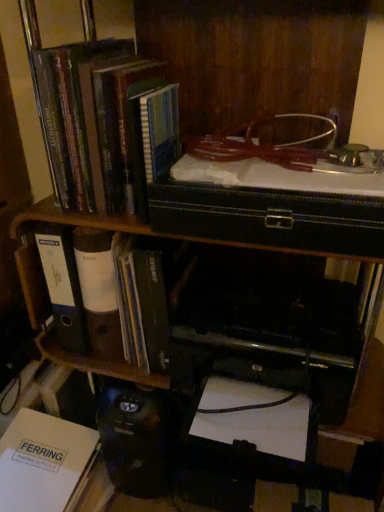
Question: Does black plastic printer at lower center come behind white paper folder at left, the 2th book in the top-to-bottom sequence?

Choices:
 (A) no
 (B) yes

Answer: (A)

Question: Is white paper folder at left, the 2th book in the top-to-bottom sequence, surrounded by black plastic printer at lower center?

Choices:
 (A) no
 (B) yes

Answer: (A)

Question: Is black plastic printer at lower center closer to camera compared to white paper folder at left, the 2th book in the top-to-bottom sequence?

Choices:
 (A) no
 (B) yes

Answer: (B)

Question: From a real-world perspective, is black plastic printer at lower center positioned under white paper folder at left, the 2th book in the top-to-bottom sequence, based on gravity?

Choices:
 (A) yes
 (B) no

Answer: (A)

Question: Is black plastic printer at lower center looking in the opposite direction of white paper folder at left, the 2th book in the top-to-bottom sequence?

Choices:
 (A) yes
 (B) no

Answer: (B)

Question: Is black plastic printer at lower center oriented towards white paper folder at left, the 2th book in the top-to-bottom sequence?

Choices:
 (A) yes
 (B) no

Answer: (B)

Question: Does hardcover book at upper left, the third book ordered from the bottom, have a lesser width compared to white paper folder at left, positioned as the 2th book in bottom-to-top order?

Choices:
 (A) yes
 (B) no

Answer: (A)

Question: Is hardcover book at upper left, the third book ordered from the bottom, closer to the viewer compared to white paper folder at left, the 2th book in the top-to-bottom sequence?

Choices:
 (A) no
 (B) yes

Answer: (B)

Question: Is hardcover book at upper left, the third book ordered from the bottom, placed right next to white paper folder at left, positioned as the 2th book in bottom-to-top order?

Choices:
 (A) no
 (B) yes

Answer: (A)

Question: Considering the relative sizes of hardcover book at upper left, the third book ordered from the bottom, and white paper folder at left, the 2th book in the top-to-bottom sequence, in the image provided, is hardcover book at upper left, the third book ordered from the bottom, shorter than white paper folder at left, the 2th book in the top-to-bottom sequence,?

Choices:
 (A) no
 (B) yes

Answer: (A)

Question: Considering the relative positions of hardcover book at upper left, the third book ordered from the bottom, and white paper folder at left, positioned as the 2th book in bottom-to-top order, in the image provided, is hardcover book at upper left, the third book ordered from the bottom, to the left of white paper folder at left, positioned as the 2th book in bottom-to-top order, from the viewer's perspective?

Choices:
 (A) no
 (B) yes

Answer: (A)

Question: From a real-world perspective, is hardcover book at upper left, which is the first book from top to bottom, positioned under white paper folder at left, the 2th book in the top-to-bottom sequence, based on gravity?

Choices:
 (A) no
 (B) yes

Answer: (A)

Question: Is white paper folder at left, the 2th book in the top-to-bottom sequence, shorter than white paper at lower left, placed as the 1th book when sorted from bottom to top?

Choices:
 (A) no
 (B) yes

Answer: (A)